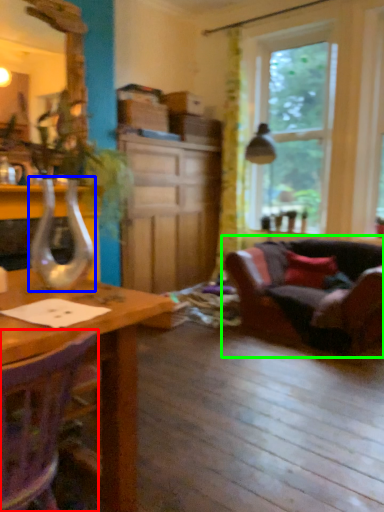
Question: Considering the real-world distances, which object is closest to chair (highlighted by a red box)? glass vase (highlighted by a blue box) or studio couch (highlighted by a green box).

Choices:
 (A) glass vase
 (B) studio couch

Answer: (A)